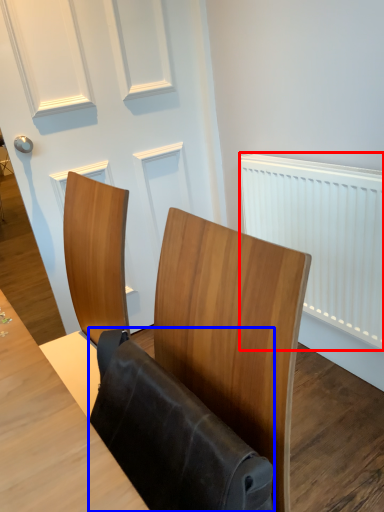
Question: Which point is further to the camera, radiator (highlighted by a red box) or folding chair (highlighted by a blue box)?

Choices:
 (A) radiator
 (B) folding chair

Answer: (A)